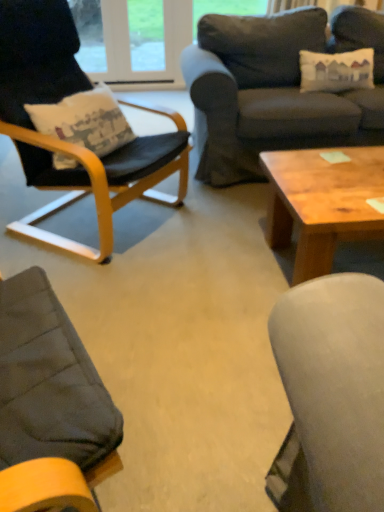
The width and height of the screenshot is (384, 512). Describe the element at coordinates (276, 88) in the screenshot. I see `dark gray fabric couch at upper right` at that location.

Identify the location of black leather chair at left. The height and width of the screenshot is (512, 384). (71, 143).

In order to click on dark gray fabric couch at upper right in this screenshot , I will do `click(276, 88)`.

Considering the sizes of black leather chair at left and wooden coffee table at center in the image, is black leather chair at left wider or thinner than wooden coffee table at center?

In the image, black leather chair at left appears to be wider than wooden coffee table at center.

Is there a large distance between black leather chair at left and wooden coffee table at center?

That's not correct — black leather chair at left is a little close to wooden coffee table at center.

From a real-world perspective, which is physically above, black leather chair at left or wooden coffee table at center?

black leather chair at left, from a real-world perspective.

Measure the distance between black leather chair at left and wooden coffee table at center.

29.34 inches.

Visually, is wooden coffee table at center positioned to the left or to the right of dark gray fabric couch at upper right?

wooden coffee table at center is to the left of dark gray fabric couch at upper right.

Considering the relative sizes of wooden coffee table at center and dark gray fabric couch at upper right in the image provided, is wooden coffee table at center thinner than dark gray fabric couch at upper right?

Indeed, wooden coffee table at center has a lesser width compared to dark gray fabric couch at upper right.

Which of these two, wooden coffee table at center or dark gray fabric couch at upper right, is bigger?

dark gray fabric couch at upper right is bigger.

Could you tell me if wooden coffee table at center is facing dark gray fabric couch at upper right?

No, wooden coffee table at center is not oriented towards dark gray fabric couch at upper right.

Find the location of a particular element. Image resolution: width=384 pixels, height=512 pixels. chair above the wooden coffee table at center (from a real-world perspective) is located at coordinates (71, 143).

How distant is wooden coffee table at center from black leather chair at left?

29.34 inches.

From the picture: Does wooden coffee table at center have a lesser width compared to black leather chair at left?

Yes, wooden coffee table at center is thinner than black leather chair at left.

From a real-world perspective, is wooden coffee table at center physically below black leather chair at left?

Yes.

Consider the image. Is dark gray fabric couch at upper right spatially inside black leather chair at left, or outside of it?

dark gray fabric couch at upper right is not inside black leather chair at left, it's outside.

Considering the points (216, 125) and (63, 186), which point is in front, point (216, 125) or point (63, 186)?

The point (63, 186) is closer.

From the picture: From the image's perspective, between dark gray fabric couch at upper right and black leather chair at left, which one is located above?

dark gray fabric couch at upper right is shown above in the image.

Which of these two, dark gray fabric couch at upper right or black leather chair at left, is thinner?

black leather chair at left is thinner.

Which is in front, point (322, 11) or point (288, 154)?

Point (288, 154)

This screenshot has width=384, height=512. Identify the location of coffee table that is in front of the dark gray fabric couch at upper right. (322, 203).

Would you say dark gray fabric couch at upper right is a long distance from wooden coffee table at center?

Actually, dark gray fabric couch at upper right and wooden coffee table at center are a little close together.

Can you confirm if dark gray fabric couch at upper right is shorter than wooden coffee table at center?

In fact, dark gray fabric couch at upper right may be taller than wooden coffee table at center.

Between point (3, 65) and point (347, 44), which one is positioned behind?

The point (347, 44) is farther.

Is black leather chair at left aimed at dark gray fabric couch at upper right?

No.

Based on the photo, can dark gray fabric couch at upper right be found inside black leather chair at left?

No, dark gray fabric couch at upper right is not a part of black leather chair at left.

Is black leather chair at left positioned far away from dark gray fabric couch at upper right?

No, black leather chair at left is not far away from dark gray fabric couch at upper right.

In order to click on coffee table on the right of black leather chair at left in this screenshot , I will do `click(322, 203)`.

This screenshot has height=512, width=384. Find the location of `studio couch above the wooden coffee table at center (from a real-world perspective)`. studio couch above the wooden coffee table at center (from a real-world perspective) is located at coordinates (276, 88).

Looking at the image, which one is located further to black leather chair at left, dark gray fabric couch at upper right or wooden coffee table at center?

Based on the image, dark gray fabric couch at upper right appears to be further to black leather chair at left.

From the image, which object appears to be farther from wooden coffee table at center, dark gray fabric couch at upper right or black leather chair at left?

Among the two, dark gray fabric couch at upper right is located further to wooden coffee table at center.

Which object lies further to the anchor point wooden coffee table at center, black leather chair at left or dark gray fabric couch at upper right?

dark gray fabric couch at upper right is further to wooden coffee table at center.

In the scene shown: Considering their positions, is wooden coffee table at center positioned further to black leather chair at left than dark gray fabric couch at upper right?

Based on the image, dark gray fabric couch at upper right appears to be further to black leather chair at left.

Considering their positions, is black leather chair at left positioned closer to dark gray fabric couch at upper right than wooden coffee table at center?

black leather chair at left is positioned closer to the anchor dark gray fabric couch at upper right.

Based on their spatial positions, is wooden coffee table at center or black leather chair at left closer to dark gray fabric couch at upper right?

Among the two, black leather chair at left is located nearer to dark gray fabric couch at upper right.

Where is `coffee table situated between black leather chair at left and dark gray fabric couch at upper right from left to right`? This screenshot has width=384, height=512. coffee table situated between black leather chair at left and dark gray fabric couch at upper right from left to right is located at coordinates (322, 203).